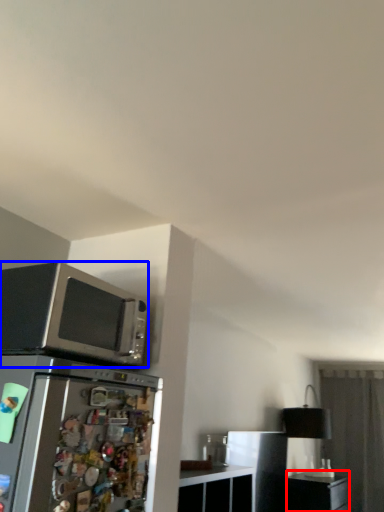
Question: Among these objects, which one is farthest to the camera, file cabinet (highlighted by a red box) or microwave oven (highlighted by a blue box)?

Choices:
 (A) file cabinet
 (B) microwave oven

Answer: (A)